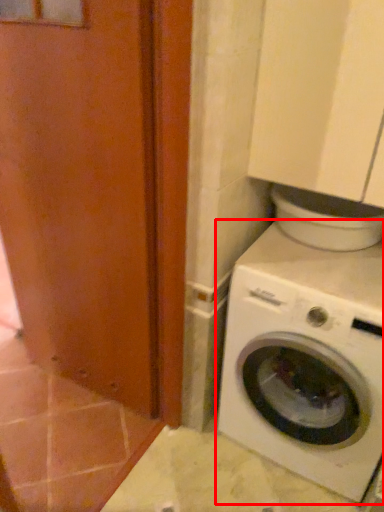
Question: From the image's perspective, what is the correct spatial relationship of washing machine (annotated by the red box) in relation to screen door?

Choices:
 (A) above
 (B) below

Answer: (B)